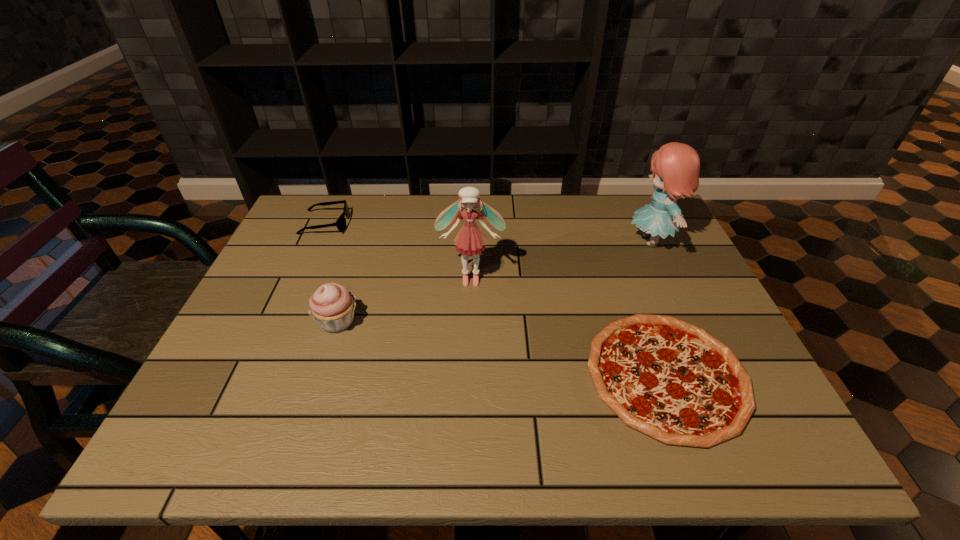
Locate an element on the screen. The image size is (960, 540). object located at the far left corner is located at coordinates point(341,221).

Image resolution: width=960 pixels, height=540 pixels. I want to click on object that is positioned at the far right corner, so click(675, 166).

Where is `object at the near right corner`? The height and width of the screenshot is (540, 960). object at the near right corner is located at coordinates (671, 380).

The height and width of the screenshot is (540, 960). In order to click on vacant space at the far edge of the desktop in this screenshot , I will do `click(365, 217)`.

You are a GUI agent. You are given a task and a screenshot of the screen. Output one action in this format:
    pyautogui.click(x=<x>, y=<y>)
    Task: Click on the vacant space at the near edge
    
    Given the screenshot: What is the action you would take?
    pyautogui.click(x=468, y=455)

In the image, there is a desktop. Identify the location of vacant area at the left edge. (326, 246).

The image size is (960, 540). I want to click on vacant space at the right edge, so click(648, 242).

I want to click on vacant space at the near left corner of the desktop, so click(x=185, y=424).

Locate an element on the screen. vacant space at the far right corner of the desktop is located at coordinates (630, 233).

Find the location of a particular element. free space between the third object from right to left and the right doll is located at coordinates tap(561, 260).